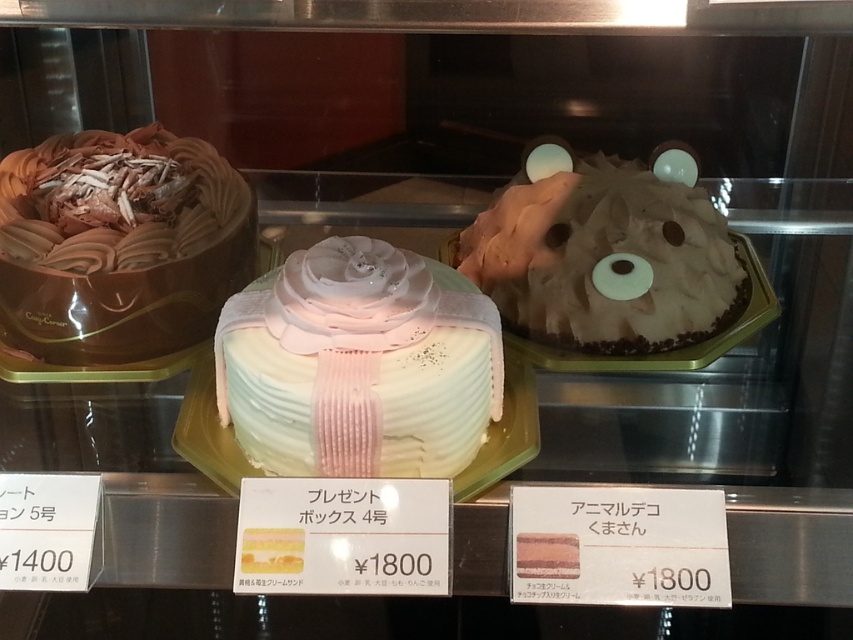
You are a customer looking at the display case and want to take a photo of the white glossy cake at center without the chocolate frosted cake at left blocking it. How should you position yourself to achieve this?

The white glossy cake at center is in front of the chocolate frosted cake at left, so positioning yourself directly in front of the white glossy cake at center will ensure the chocolate frosted cake at left does not block the view.

You are a customer in the bakery and want to take a photo of both point (489, 316) and point (599, 289) in the display case. Which point should you focus on first to ensure both are in the frame?

You should focus on point (489, 316) first because it is in front of point (599, 289), so capturing it first ensures both points remain visible in the frame.